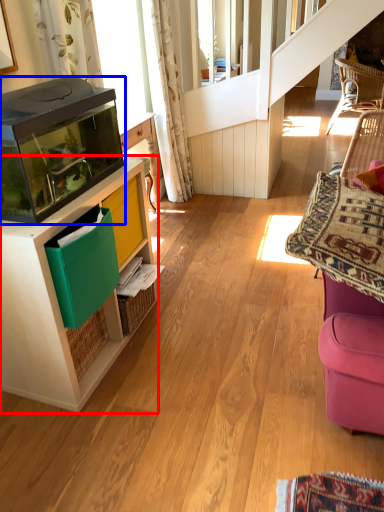
Question: Among these objects, which one is farthest to the camera, cabinetry (highlighted by a red box) or appliance (highlighted by a blue box)?

Choices:
 (A) cabinetry
 (B) appliance

Answer: (A)